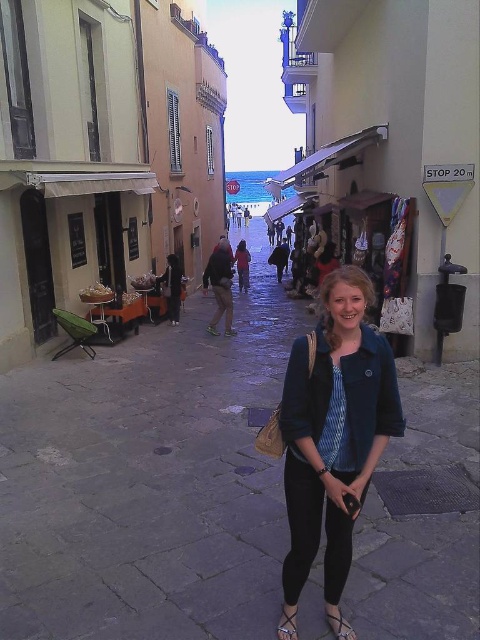
Is denim jacket at center shorter than leather sandal at lower center?

Incorrect, denim jacket at center's height does not fall short of leather sandal at lower center's.

Can you confirm if denim jacket at center is thinner than leather sandal at lower center?

In fact, denim jacket at center might be wider than leather sandal at lower center.

Which is in front, point (357, 403) or point (287, 620)?

Point (357, 403)

The height and width of the screenshot is (640, 480). Find the location of `denim jacket at center`. denim jacket at center is located at coordinates (334, 429).

What do you see at coordinates (334, 429) in the screenshot?
I see `denim jacket at center` at bounding box center [334, 429].

Is denim jacket at center positioned in front of black leather sandal at lower center?

Yes, denim jacket at center is in front of black leather sandal at lower center.

Who is more distant from viewer, (301, 362) or (336, 628)?

The point (336, 628) is more distant.

Locate an element on the screen. This screenshot has height=640, width=480. denim jacket at center is located at coordinates (334, 429).

Which of these two, black leather sandal at lower center or leather sandal at lower center, stands shorter?

black leather sandal at lower center is shorter.

Who is higher up, black leather sandal at lower center or leather sandal at lower center?

leather sandal at lower center is higher up.

This screenshot has height=640, width=480. Identify the location of black leather sandal at lower center. (338, 624).